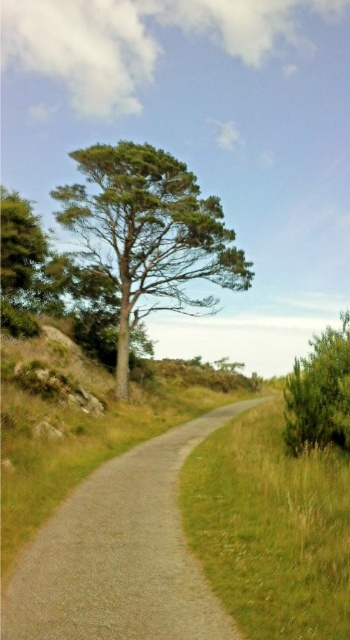
Question: Which object appears closest to the camera in this image?

Choices:
 (A) green matte tree at left
 (B) green leafy bush at right
 (C) gravel road at center
 (D) green matte tree at center

Answer: (C)

Question: Which point is farther to the camera?

Choices:
 (A) green matte tree at center
 (B) green matte tree at left
 (C) green leafy bush at right

Answer: (A)

Question: Which point is farther to the camera?

Choices:
 (A) green matte tree at left
 (B) green matte tree at center
 (C) green leafy bush at right
 (D) green grassy at right

Answer: (B)

Question: Is green grassy at right wider than green matte tree at left?

Choices:
 (A) yes
 (B) no

Answer: (B)

Question: Does green grassy at right have a smaller size compared to green matte tree at center?

Choices:
 (A) no
 (B) yes

Answer: (B)

Question: Is green matte tree at center in front of green matte tree at left?

Choices:
 (A) yes
 (B) no

Answer: (B)